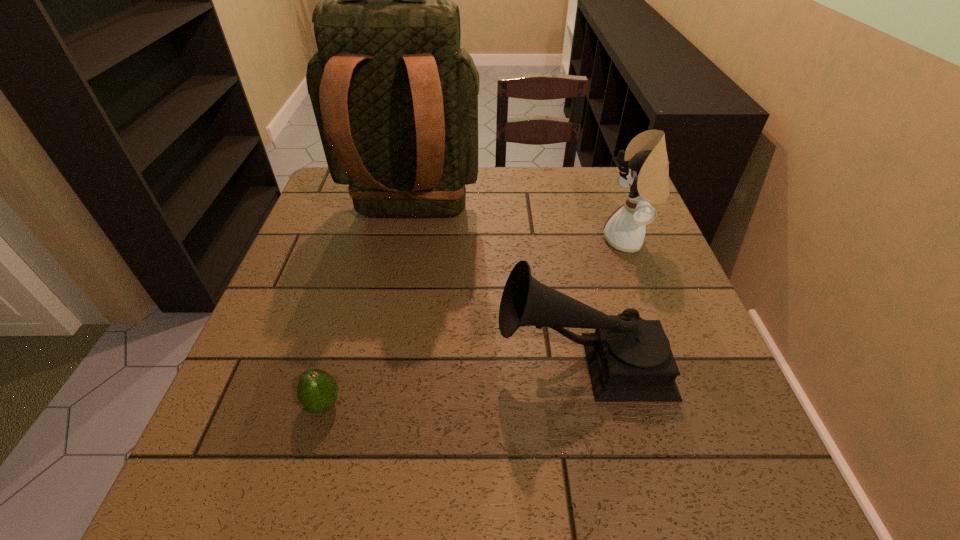
You are a GUI agent. You are given a task and a screenshot of the screen. Output one action in this format:
    pyautogui.click(x=<x>, y=<y>)
    Task: Click on the backpack
    This screenshot has width=960, height=540.
    Given the screenshot: What is the action you would take?
    pyautogui.click(x=395, y=99)

Where is `doll`? This screenshot has height=540, width=960. doll is located at coordinates (645, 171).

This screenshot has width=960, height=540. In order to click on phonograph_record in this screenshot , I will do click(x=630, y=360).

Locate an element on the screen. This screenshot has height=540, width=960. the shortest object is located at coordinates (317, 391).

Image resolution: width=960 pixels, height=540 pixels. In order to click on vacant region located 0.110m on the back of the backpack in this screenshot , I will do `click(396, 295)`.

The height and width of the screenshot is (540, 960). I want to click on free space located at the front face of the doll, so click(x=529, y=241).

In order to click on vacant space situated at the front face of the doll in this screenshot , I will do `click(561, 241)`.

Where is `free space located at the front face of the doll`? Image resolution: width=960 pixels, height=540 pixels. free space located at the front face of the doll is located at coordinates (x=462, y=241).

The width and height of the screenshot is (960, 540). Find the location of `vacant space located 0.050m from the horn of the phonograph_record`. vacant space located 0.050m from the horn of the phonograph_record is located at coordinates (471, 360).

What are the coordinates of `vacant space located 0.260m from the horn of the phonograph_record` in the screenshot? It's located at (364, 360).